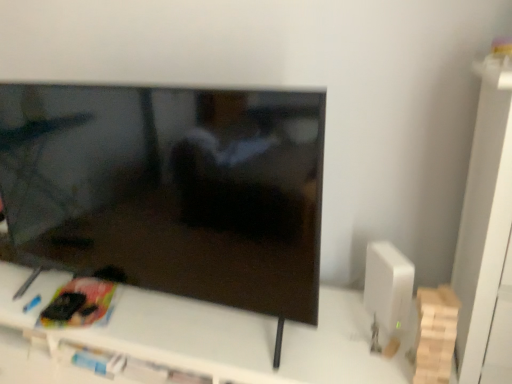
In order to click on vacant space in matte black tv at center (from a real-world perspective) in this screenshot , I will do `click(187, 319)`.